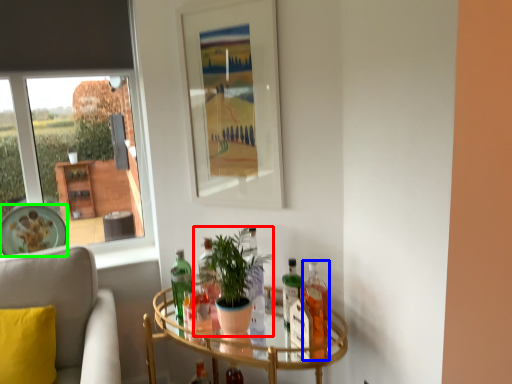
Question: Which is farther away from houseplant (highlighted by a red box)? bottle (highlighted by a blue box) or plate (highlighted by a green box)?

Choices:
 (A) bottle
 (B) plate

Answer: (B)